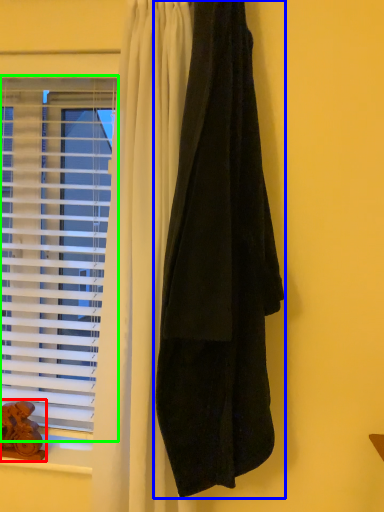
Question: Which is farther away from animal (highlighted by a red box)? curtain (highlighted by a blue box) or window (highlighted by a green box)?

Choices:
 (A) curtain
 (B) window

Answer: (A)